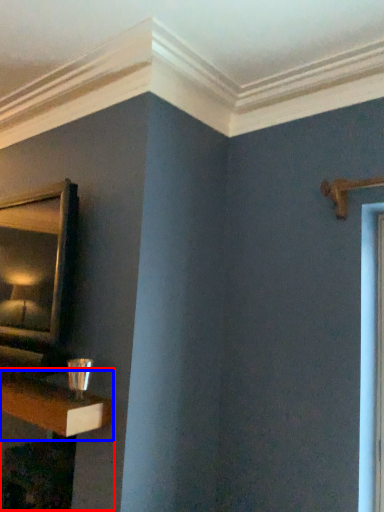
Question: Which point is further to the camera, table (highlighted by a red box) or shelf (highlighted by a blue box)?

Choices:
 (A) table
 (B) shelf

Answer: (A)